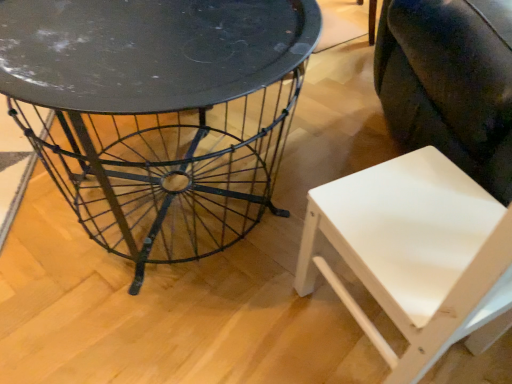
Question: Is metallic wire table at center a part of white matte chair at lower right?

Choices:
 (A) no
 (B) yes

Answer: (A)

Question: Can you confirm if white matte chair at lower right is shorter than metallic wire table at center?

Choices:
 (A) no
 (B) yes

Answer: (A)

Question: Does white matte chair at lower right appear on the right side of metallic wire table at center?

Choices:
 (A) yes
 (B) no

Answer: (A)

Question: Considering the relative positions of white matte chair at lower right and metallic wire table at center in the image provided, is white matte chair at lower right in front of metallic wire table at center?

Choices:
 (A) yes
 (B) no

Answer: (A)

Question: Considering the relative positions of white matte chair at lower right and metallic wire table at center in the image provided, is white matte chair at lower right to the left of metallic wire table at center from the viewer's perspective?

Choices:
 (A) no
 (B) yes

Answer: (A)

Question: From the image's perspective, is white matte swivel chair at lower right located above or below metallic wire table at center?

Choices:
 (A) above
 (B) below

Answer: (A)

Question: From a real-world perspective, is white matte swivel chair at lower right above or below metallic wire table at center?

Choices:
 (A) above
 (B) below

Answer: (A)

Question: Based on their sizes in the image, would you say white matte swivel chair at lower right is bigger or smaller than metallic wire table at center?

Choices:
 (A) small
 (B) big

Answer: (B)

Question: Would you say white matte swivel chair at lower right is to the left or to the right of metallic wire table at center in the picture?

Choices:
 (A) right
 (B) left

Answer: (A)

Question: Considering the positions of white matte swivel chair at lower right and white matte chair at lower right in the image, is white matte swivel chair at lower right bigger or smaller than white matte chair at lower right?

Choices:
 (A) big
 (B) small

Answer: (A)

Question: Considering the relative positions of white matte swivel chair at lower right and white matte chair at lower right in the image provided, is white matte swivel chair at lower right to the left or to the right of white matte chair at lower right?

Choices:
 (A) left
 (B) right

Answer: (B)

Question: From the image's perspective, relative to white matte chair at lower right, is white matte swivel chair at lower right above or below?

Choices:
 (A) below
 (B) above

Answer: (B)

Question: Considering the positions of point (452, 23) and point (419, 226), is point (452, 23) closer or farther from the camera than point (419, 226)?

Choices:
 (A) farther
 (B) closer

Answer: (A)

Question: From their relative heights in the image, would you say white matte chair at lower right is taller or shorter than white matte swivel chair at lower right?

Choices:
 (A) tall
 (B) short

Answer: (B)

Question: From a real-world perspective, relative to white matte swivel chair at lower right, is white matte chair at lower right vertically above or below?

Choices:
 (A) below
 (B) above

Answer: (A)